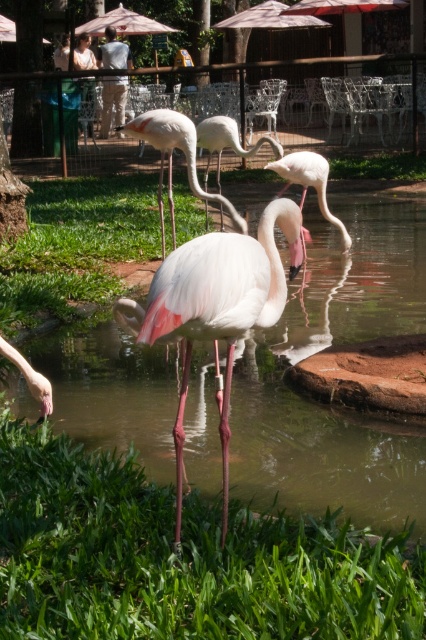
You are a visitor trying to take a photo of the pink matte flamingo at center. The pink glossy water at center is in the way. Can you walk around the water to get a clear shot?

The pink glossy water at center is narrower than the pink matte flamingo at center, so you can walk around the water to get a clear shot of the pink matte flamingo at center.

You are standing at the origin point in the image. You want to walk to the point located at coordinates point (281, 403). However, there is an obstacle at point (42, 419). Will you be able to see the destination point once you reach the obstacle?

Point (281, 403) is behind point (42, 419), so once you reach the obstacle at point (42, 419), the destination point will be blocked from view.

Consider the image. You are a visitor standing at the entrance of the flamingo enclosure. You see the pink glossy water at center and the pink matte flamingo at center. Which object is closer to the ground?

The pink glossy water at center is located below the pink matte flamingo at center, so the pink glossy water at center is closer to the ground.